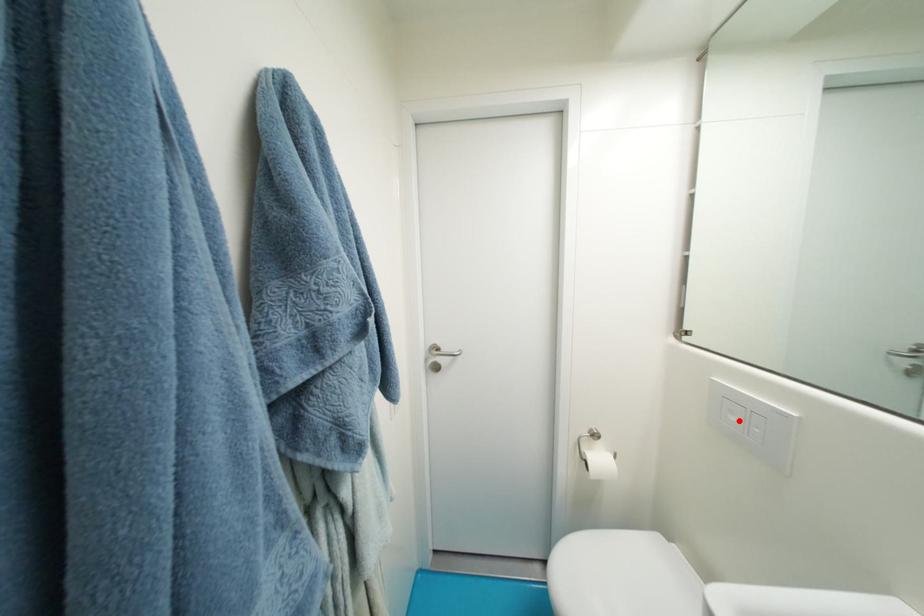
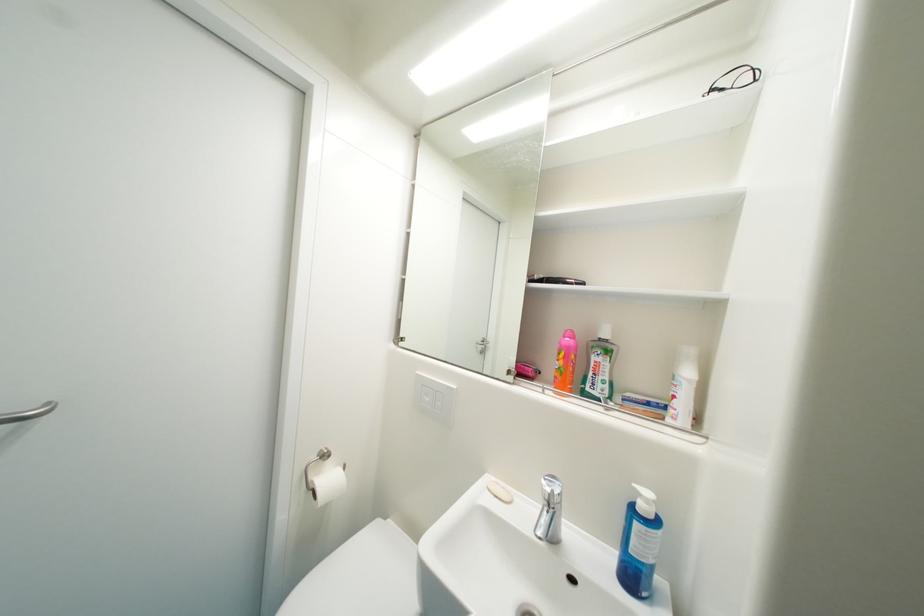
Locate, in the second image, the point that corresponds to the highlighted location in the first image.

(433, 400)